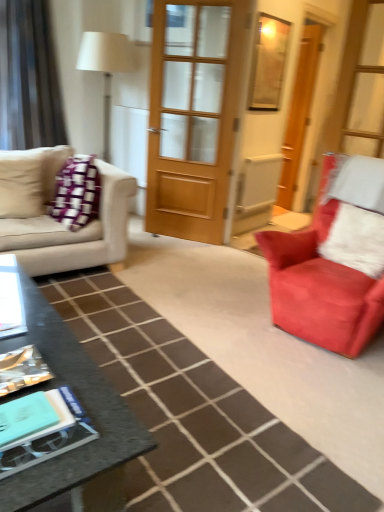
Question: Considering the positions of white fluffy pillow at right and wooden door at center, arranged as the first door when viewed from the right, in the image, is white fluffy pillow at right bigger or smaller than wooden door at center, arranged as the first door when viewed from the right,?

Choices:
 (A) big
 (B) small

Answer: (A)

Question: In terms of width, does white fluffy pillow at right look wider or thinner when compared to wooden door at center, placed as the first door when sorted from back to front?

Choices:
 (A) wide
 (B) thin

Answer: (A)

Question: Which of these objects is positioned farthest from the smooth black coffee table at center?

Choices:
 (A) wooden door at center, which ranks as the 2th door in left-to-right order
 (B) granite black coffee table at lower left
 (C) suede red armchair at right
 (D) silky beige curtain at left
 (E) beige fabric couch at left

Answer: (A)

Question: Based on their relative distances, which object is farther from the wooden door at center, placed as the second door when sorted from back to front?

Choices:
 (A) suede red armchair at right
 (B) beige fabric couch at left
 (C) wooden frame at upper center
 (D) silky beige curtain at left
 (E) smooth black coffee table at center

Answer: (E)